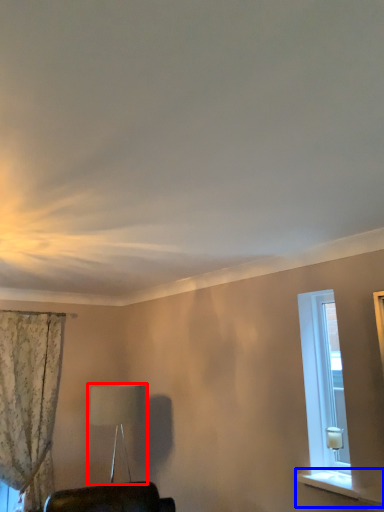
Question: Which point is closer to the camera, table lamp (highlighted by a red box) or window sill (highlighted by a blue box)?

Choices:
 (A) table lamp
 (B) window sill

Answer: (B)